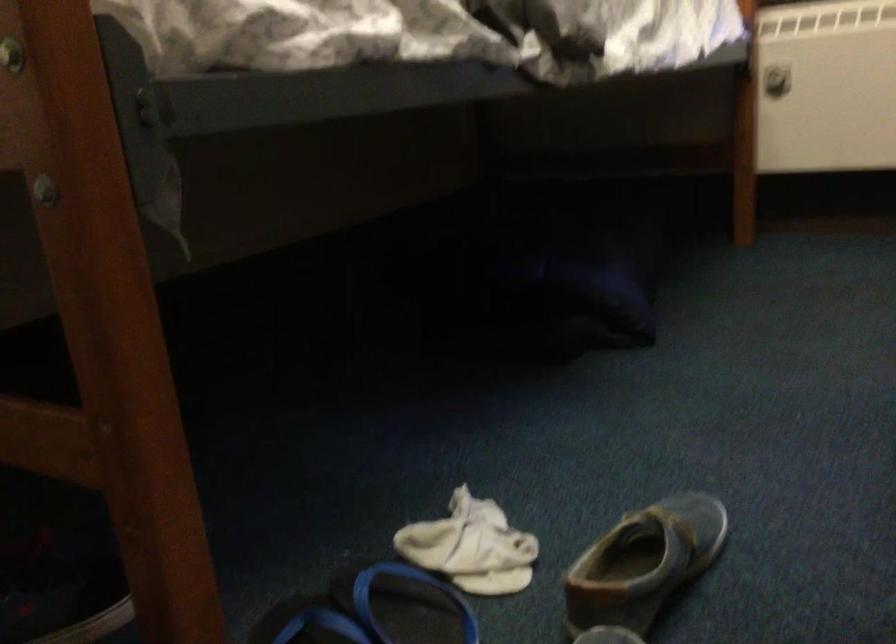
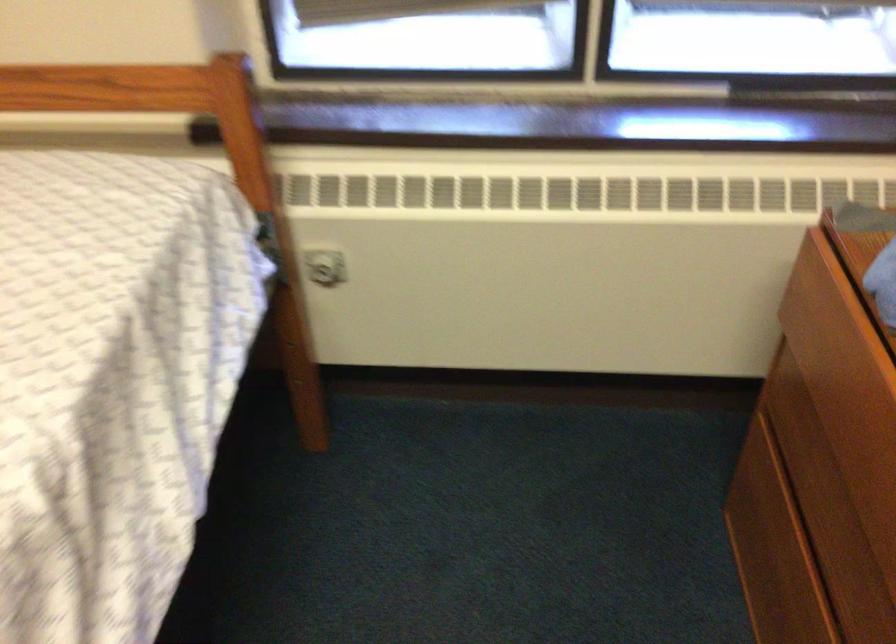
Where in the second image is the point corresponding to pixel 769 75 from the first image?

(323, 267)